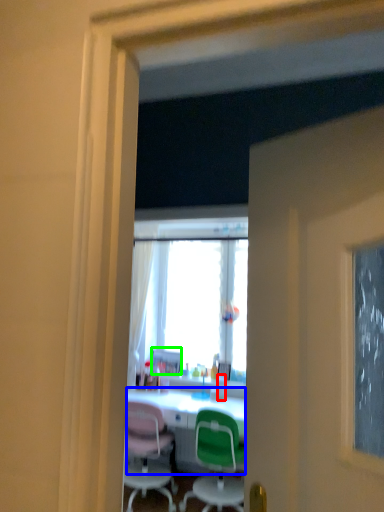
Question: Based on their relative distances, which object is farther from bottle (highlighted by a red box)? Choose from desk (highlighted by a blue box) and picture frame (highlighted by a green box).

Choices:
 (A) desk
 (B) picture frame

Answer: (B)